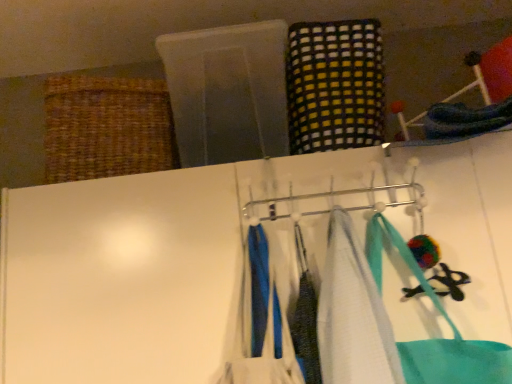
Question: Can you confirm if white fabric towel at center is thinner than metallic silver hanger at center?

Choices:
 (A) no
 (B) yes

Answer: (A)

Question: Does white fabric towel at center have a lesser height compared to metallic silver hanger at center?

Choices:
 (A) yes
 (B) no

Answer: (B)

Question: Is metallic silver hanger at center located within white fabric towel at center?

Choices:
 (A) no
 (B) yes

Answer: (A)

Question: Is white fabric towel at center further to the viewer compared to metallic silver hanger at center?

Choices:
 (A) yes
 (B) no

Answer: (B)

Question: Can you confirm if white fabric towel at center is smaller than metallic silver hanger at center?

Choices:
 (A) no
 (B) yes

Answer: (B)

Question: Based on their positions, is woven brown basket at upper left located to the left or right of white fabric towel at center?

Choices:
 (A) right
 (B) left

Answer: (B)

Question: Considering the positions of woven brown basket at upper left and white fabric towel at center in the image, is woven brown basket at upper left bigger or smaller than white fabric towel at center?

Choices:
 (A) big
 (B) small

Answer: (A)

Question: Relative to white fabric towel at center, is woven brown basket at upper left in front or behind?

Choices:
 (A) front
 (B) behind

Answer: (B)

Question: From a real-world perspective, relative to white fabric towel at center, is woven brown basket at upper left vertically above or below?

Choices:
 (A) below
 (B) above

Answer: (B)

Question: In terms of height, does multicolored woven cloth at upper center, which ranks as the second clothing in left-to-right order, look taller or shorter compared to blue fabric at center, the 1th clothing positioned from the bottom?

Choices:
 (A) short
 (B) tall

Answer: (B)

Question: Would you say multicolored woven cloth at upper center, which is the first clothing in right-to-left order, is to the left or to the right of blue fabric at center, positioned as the 1th clothing in left-to-right order, in the picture?

Choices:
 (A) right
 (B) left

Answer: (A)

Question: Is multicolored woven cloth at upper center, marked as the second clothing in a front-to-back arrangement, wider or thinner than blue fabric at center, placed as the 2th clothing when sorted from back to front?

Choices:
 (A) wide
 (B) thin

Answer: (A)

Question: Considering the positions of multicolored woven cloth at upper center, which is the first clothing in right-to-left order, and blue fabric at center, which is the second clothing in right-to-left order, in the image, is multicolored woven cloth at upper center, which is the first clothing in right-to-left order, bigger or smaller than blue fabric at center, which is the second clothing in right-to-left order,?

Choices:
 (A) small
 (B) big

Answer: (B)

Question: Considering the positions of point (253, 278) and point (372, 201), is point (253, 278) closer or farther from the camera than point (372, 201)?

Choices:
 (A) farther
 (B) closer

Answer: (B)

Question: Considering the positions of blue fabric at center, positioned as the 1th clothing in left-to-right order, and metallic silver hanger at center in the image, is blue fabric at center, positioned as the 1th clothing in left-to-right order, taller or shorter than metallic silver hanger at center?

Choices:
 (A) tall
 (B) short

Answer: (A)